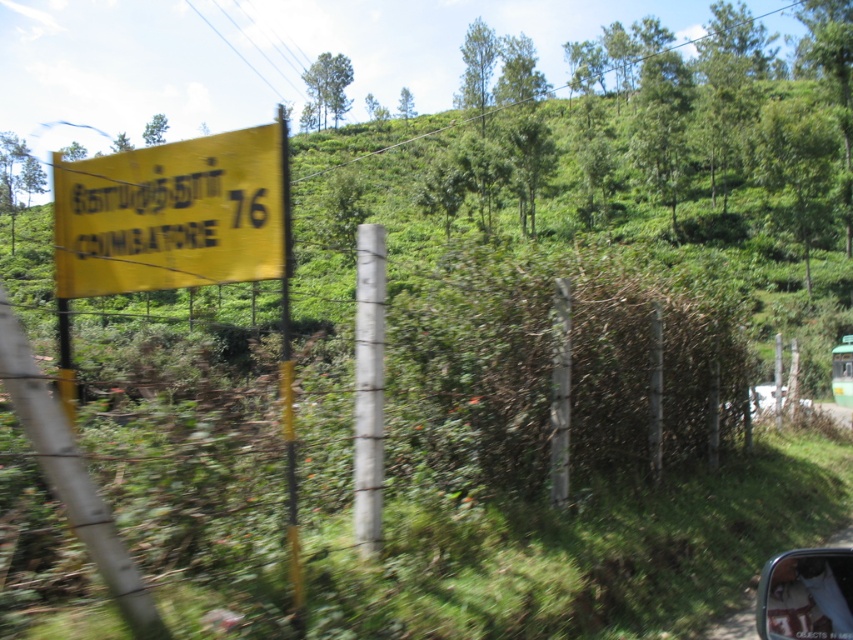
Question: Can you confirm if yellow matte sign at left is thinner than transparent plastic car window at lower right?

Choices:
 (A) no
 (B) yes

Answer: (A)

Question: Does yellow matte sign at left appear under green matte car at right?

Choices:
 (A) yes
 (B) no

Answer: (B)

Question: Which of the following is the closest to the observer?

Choices:
 (A) (840, 397)
 (B) (189, 243)

Answer: (B)

Question: Which object appears farthest from the camera in this image?

Choices:
 (A) green matte car at right
 (B) yellow matte sign at left

Answer: (A)

Question: Estimate the real-world distances between objects in this image. Which object is farther from the transparent plastic car window at lower right?

Choices:
 (A) yellow matte sign at left
 (B) green matte car at right

Answer: (B)

Question: Is yellow matte sign at left thinner than transparent plastic car window at lower right?

Choices:
 (A) yes
 (B) no

Answer: (B)